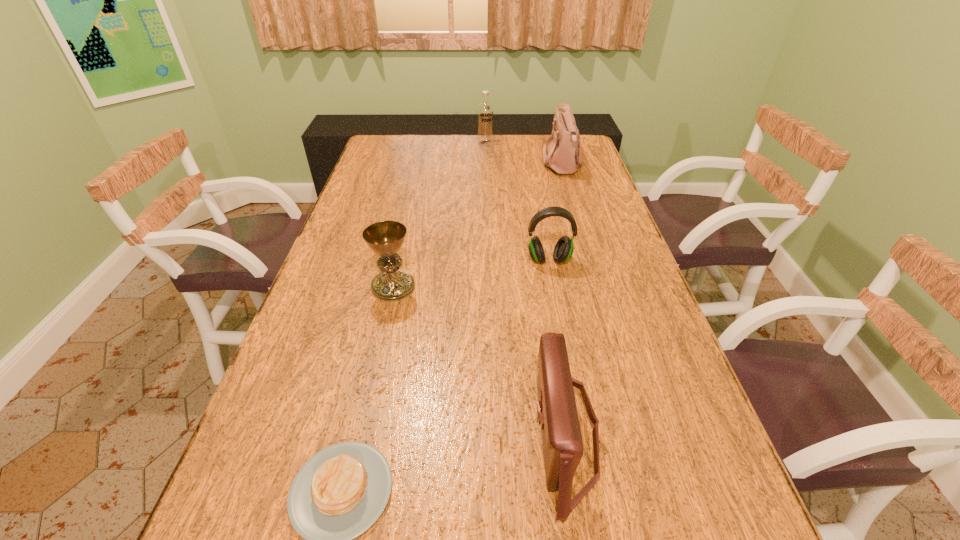
Image resolution: width=960 pixels, height=540 pixels. Identify the location of object positioned at the far right corner. (561, 157).

The height and width of the screenshot is (540, 960). I want to click on vacant area at the far edge of the desktop, so click(x=477, y=148).

You are a GUI agent. You are given a task and a screenshot of the screen. Output one action in this format:
    pyautogui.click(x=<x>, y=<y>)
    Task: Click on the free space at the left edge
    The width and height of the screenshot is (960, 540).
    Given the screenshot: What is the action you would take?
    click(x=339, y=253)

At what (x,y) coordinates should I click in order to perform the action: click on vacant space at the right edge. Please return your answer as a coordinate pair (x, y). Image resolution: width=960 pixels, height=540 pixels. Looking at the image, I should click on (583, 223).

This screenshot has width=960, height=540. In the image, there is a desktop. Find the location of `vacant space at the far left corner`. vacant space at the far left corner is located at coordinates (372, 148).

In order to click on blank region between the fourth object from right to left and the nearer shoulder bag in this screenshot , I will do click(525, 288).

Locate an element on the screen. This screenshot has height=540, width=960. free spot between the third object from left to right and the third farthest object is located at coordinates (516, 202).

The height and width of the screenshot is (540, 960). I want to click on free space between the third object from left to right and the headset, so click(516, 202).

Where is `free space between the farther shoulder bag and the nearer shoulder bag`? This screenshot has height=540, width=960. free space between the farther shoulder bag and the nearer shoulder bag is located at coordinates (564, 299).

Locate an element on the screen. vacant area that lies between the fourth farthest object and the nearer shoulder bag is located at coordinates (479, 360).